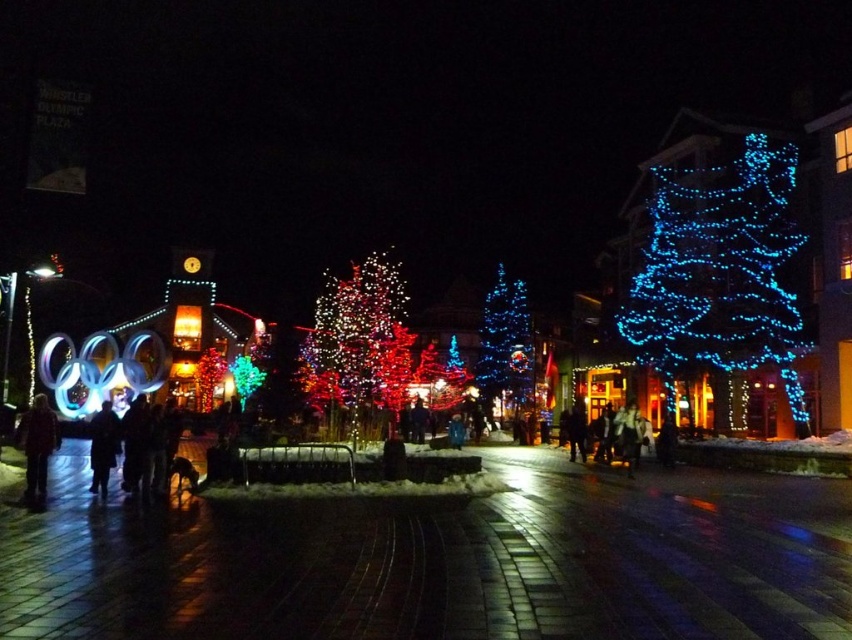
Which is above, illuminated red tree at center or dark brown coat at center?

Positioned higher is illuminated red tree at center.

Between illuminated red tree at center and dark brown coat at center, which one appears on the right side from the viewer's perspective?

illuminated red tree at center

Which is behind, point (372, 356) or point (108, 458)?

Positioned behind is point (372, 356).

This screenshot has width=852, height=640. I want to click on illuminated red tree at center, so click(354, 337).

Consider the image. Between blue led lights at center and dark brown coat at center, which one is positioned lower?

dark brown coat at center

Is blue led lights at center shorter than dark brown coat at center?

No, blue led lights at center is not shorter than dark brown coat at center.

Where is `blue led lights at center`? This screenshot has height=640, width=852. blue led lights at center is located at coordinates (505, 342).

Locate an element on the screen. Image resolution: width=852 pixels, height=640 pixels. blue led lights at center is located at coordinates (505, 342).

The image size is (852, 640). Identify the location of brick pavement at center. (439, 561).

Is point (540, 509) positioned before point (496, 298)?

Yes, it is in front of point (496, 298).

Which is in front, point (381, 602) or point (482, 381)?

Positioned in front is point (381, 602).

The image size is (852, 640). Identify the location of brick pavement at center. (439, 561).